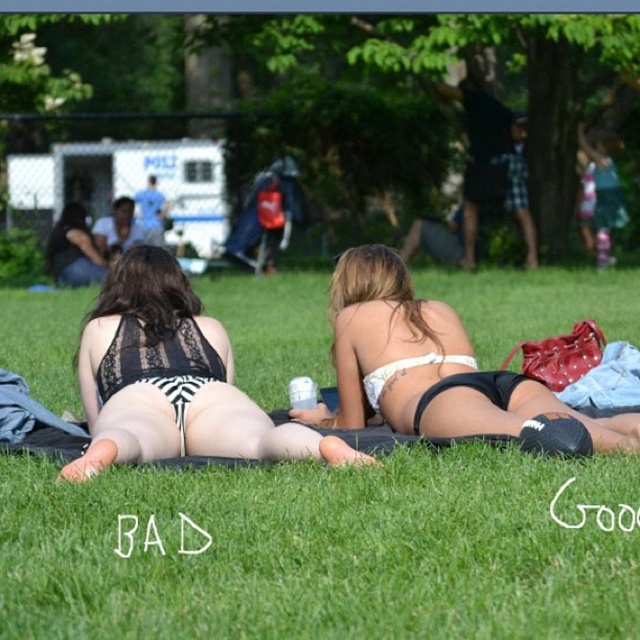
You are planning to place a small picnic basket between the green grass at center and the matte black bikini at center. Based on their widths, which object should the basket be closer to?

The green grass at center is wider than the matte black bikini at center, so the picnic basket should be placed closer to the matte black bikini at center to ensure it fits within the narrower space.

You are a photographer taking a photo of the black lace bikini at center and the matte black bikini at center. Which one should you zoom in on to capture more details of the bikini top?

The matte black bikini at center is taller than the black lace bikini at center, so zooming in on the matte black bikini at center would allow you to capture more details of the bikini top.

You are planning to place a small picnic basket on the green grass at center where the matte black bikini at center is currently located. Based on the scene, will the basket fit without overlapping the bikini?

The green grass at center has a larger size compared to matte black bikini at center, so the picnic basket should fit without overlapping the bikini as there is enough space.